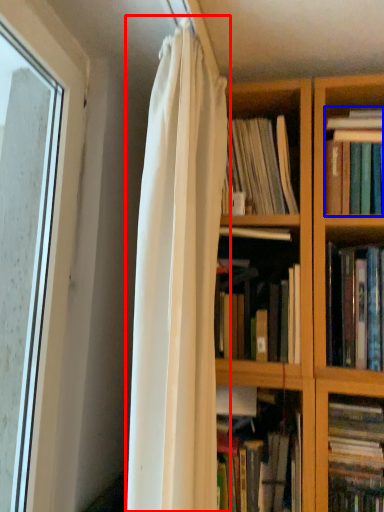
Question: Which point is closer to the camera, curtain (highlighted by a red box) or book (highlighted by a blue box)?

Choices:
 (A) curtain
 (B) book

Answer: (A)